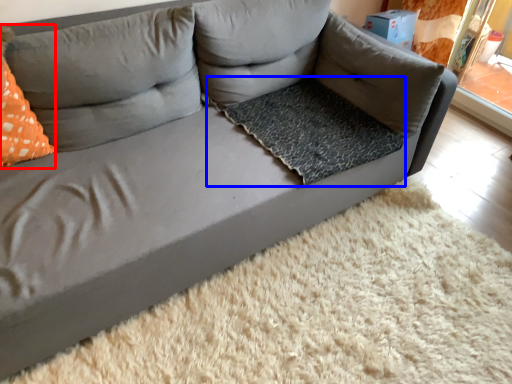
Question: Which point is further to the camera, throw pillow (highlighted by a red box) or dog bed (highlighted by a blue box)?

Choices:
 (A) throw pillow
 (B) dog bed

Answer: (B)